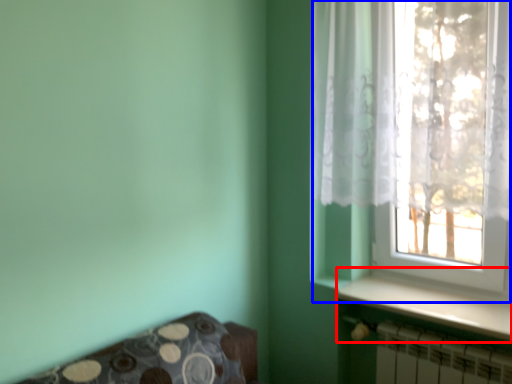
Question: Which point is closer to the camera, window sill (highlighted by a red box) or window (highlighted by a blue box)?

Choices:
 (A) window sill
 (B) window

Answer: (B)